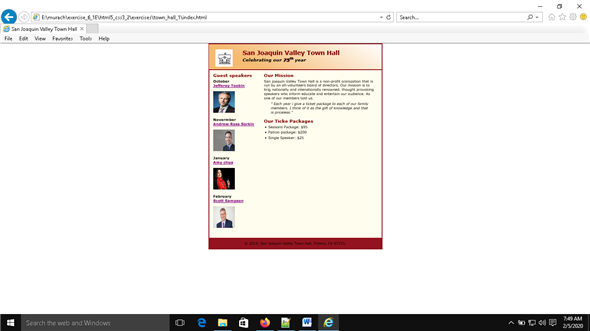
Image resolution: width=590 pixels, height=331 pixels. What are the coordinates of `exit button` in the screenshot? It's located at (580, 7).